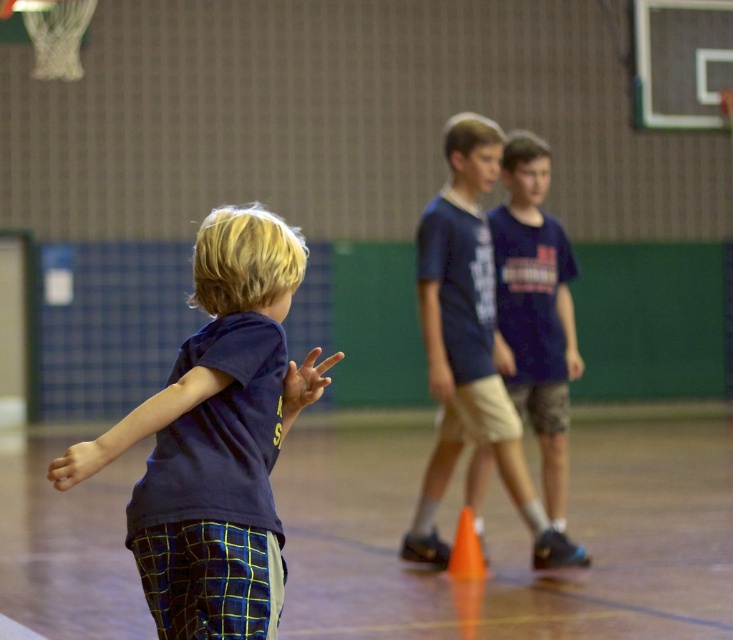
Question: Which of the following is the farthest from the observer?

Choices:
 (A) (442, 448)
 (B) (232, 220)

Answer: (A)

Question: Can you confirm if navy blue t-shirt at center is bigger than orange matte cone at center?

Choices:
 (A) no
 (B) yes

Answer: (B)

Question: Which point appears closest to the camera in this image?

Choices:
 (A) (460, 541)
 (B) (176, 541)
 (C) (457, 182)

Answer: (B)

Question: Which of the following is the closest to the observer?

Choices:
 (A) orange matte cone at center
 (B) navy blue shirt at center
 (C) navy blue t-shirt at center

Answer: (B)

Question: Can you confirm if navy blue t-shirt at center is positioned above orange matte cone at center?

Choices:
 (A) yes
 (B) no

Answer: (A)

Question: Can you confirm if navy blue t-shirt at center is positioned to the left of orange matte cone at center?

Choices:
 (A) yes
 (B) no

Answer: (B)